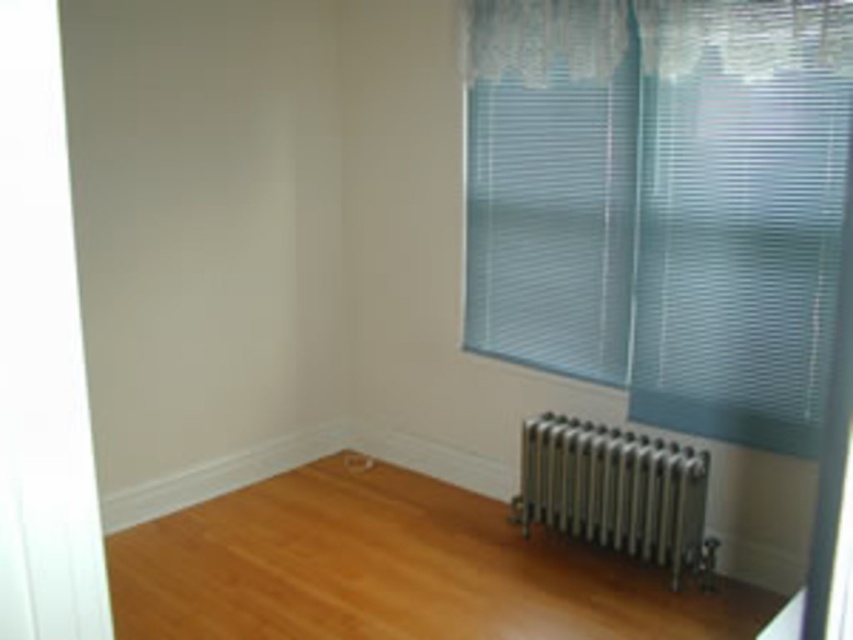
You are a delivery person trying to place a large rectangular box on the floor. The box is as wide as the white sheer curtain at upper center. Will the shiny brown hardwood floor at center be wide enough to accommodate the box?

The shiny brown hardwood floor at center might be wider than the white sheer curtain at upper center, so it is possible that the floor is wide enough to fit the box. However, since the exact width difference isn not specified, there is some uncertainty.

Based on the photo, you are an interior designer planning to install a new artwork between the translucent plastic blinds at right and the radiator. The artwork requires a minimum of 2 meters of space. Can you confirm if there is enough space between them?

The distance between the translucent plastic blinds at right and the radiator is 2.42 meters, which exceeds the required 2 meters. Therefore, there is sufficient space to install the artwork.

You are standing in the room and want to place a small potted plant on the shiny brown hardwood floor at center. However, you also need to ensure that the plant won not block the silver metallic radiator at lower right. Based on their heights, is this possible?

The shiny brown hardwood floor at center has a lesser height compared to the silver metallic radiator at lower right. Since the floor is lower, placing the plant on the floor won will not affect the radiator height, so it should be safe.